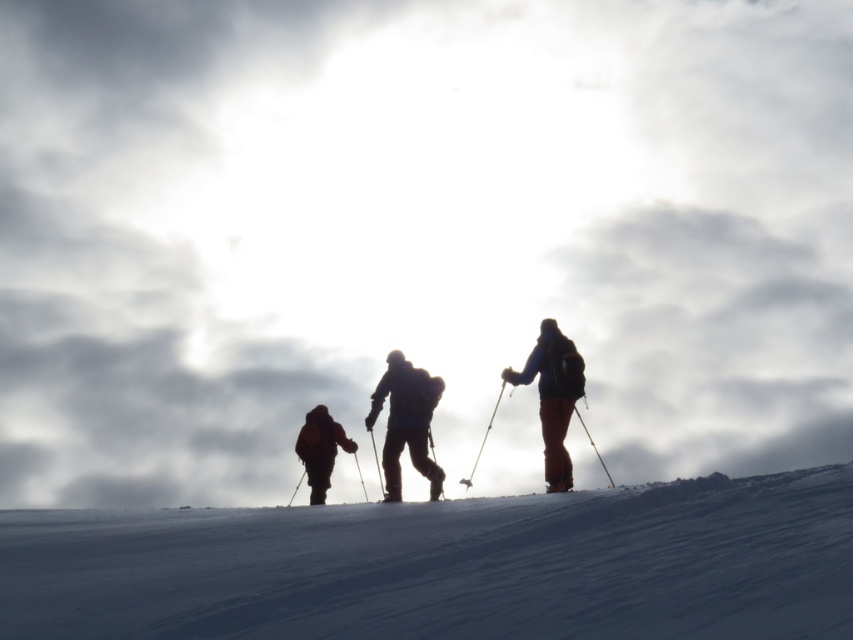
Who is shorter, dark blue fabric backpack at center or orange fabric jacket at right?

With less height is dark blue fabric backpack at center.

Is point (422, 378) behind point (544, 326)?

Yes, point (422, 378) is farther from viewer.

At what (x,y) coordinates should I click in order to perform the action: click on dark blue fabric backpack at center. Please return your answer as a coordinate pair (x, y). Looking at the image, I should click on (405, 422).

Who is positioned more to the left, white snow at center or dark blue fabric backpack at center?

white snow at center

This screenshot has width=853, height=640. Describe the element at coordinates (450, 566) in the screenshot. I see `white snow at center` at that location.

Who is more forward, (160, 564) or (399, 352)?

Point (160, 564) is more forward.

In order to click on white snow at center in this screenshot , I will do `click(450, 566)`.

Find the location of a particular element. The image size is (853, 640). white snow at center is located at coordinates (450, 566).

Can you confirm if white snow at center is smaller than dark brown jacket at center?

No.

Between point (695, 568) and point (332, 435), which one is positioned in front?

Point (695, 568)

Find the location of a particular element. white snow at center is located at coordinates (450, 566).